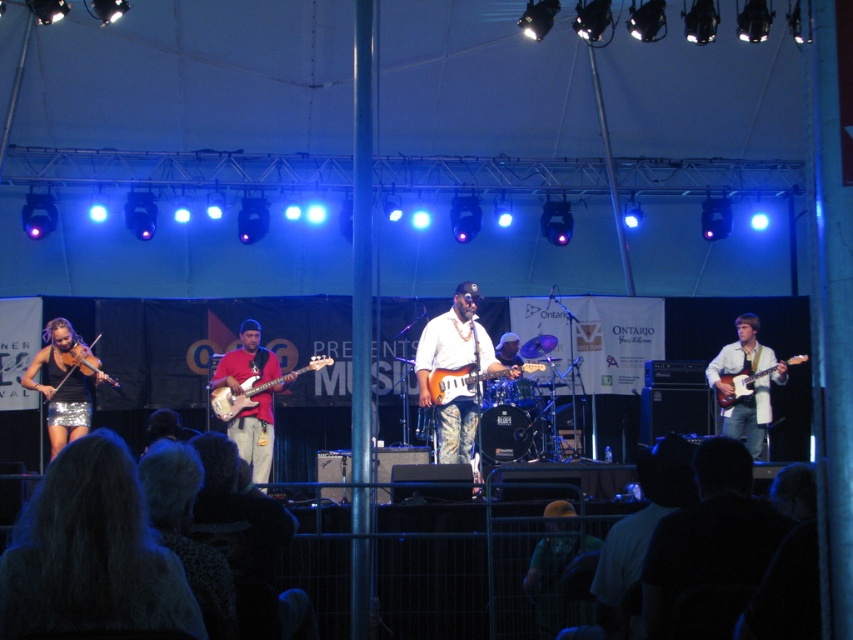
Question: Can you confirm if matte red electric bass at center is positioned below shiny electric guitar at right?

Choices:
 (A) yes
 (B) no

Answer: (A)

Question: Among these objects, which one is farthest from the camera?

Choices:
 (A) red matte guitar at center
 (B) matte black violin at left

Answer: (B)

Question: Which object is the closest to the matte black violin at left?

Choices:
 (A) shiny silver skirt at left
 (B) matte red electric bass at center
 (C) shiny orange electric guitar at center
 (D) white fabric shirt at center

Answer: (A)

Question: Is shiny silver skirt at left bigger than matte red electric bass at center?

Choices:
 (A) no
 (B) yes

Answer: (B)

Question: Does shiny silver skirt at left have a greater width compared to red matte guitar at center?

Choices:
 (A) no
 (B) yes

Answer: (B)

Question: Which of these objects is positioned closest to the white glossy guitar at center?

Choices:
 (A) shiny silver skirt at left
 (B) white fabric shirt at center

Answer: (B)